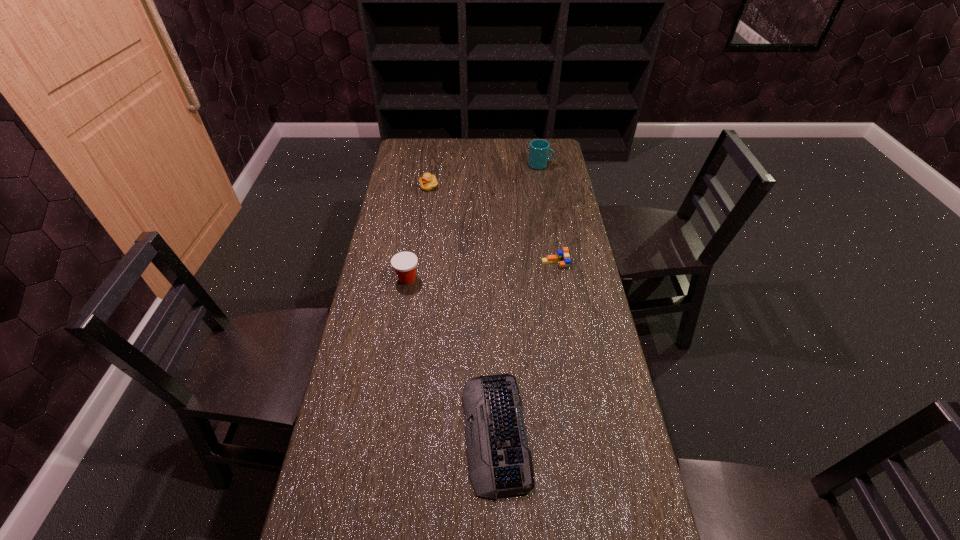
Locate an element on the screen. Image resolution: width=960 pixels, height=540 pixels. free space located 0.140m on the right of the second nearest object is located at coordinates (462, 279).

Identify the location of vacant area situated on the front-facing side of the third tallest object. The width and height of the screenshot is (960, 540). (424, 220).

The width and height of the screenshot is (960, 540). What are the coordinates of `free space located on the left of the Lego` in the screenshot? It's located at (450, 264).

The height and width of the screenshot is (540, 960). In order to click on vacant space located on the back of the nearest object in this screenshot , I will do `click(492, 322)`.

I want to click on object located in the far edge section of the desktop, so click(539, 149).

The image size is (960, 540). I want to click on Dixie cup that is at the left edge, so click(404, 263).

In order to click on duckling located in the left edge section of the desktop in this screenshot , I will do `click(428, 182)`.

You are a GUI agent. You are given a task and a screenshot of the screen. Output one action in this format:
    pyautogui.click(x=<x>, y=<y>)
    Task: Click on the cup that is at the right edge
    
    Given the screenshot: What is the action you would take?
    pyautogui.click(x=539, y=149)

Locate an element on the screen. The height and width of the screenshot is (540, 960). Lego positioned at the right edge is located at coordinates (x=562, y=257).

I want to click on object at the far right corner, so click(539, 149).